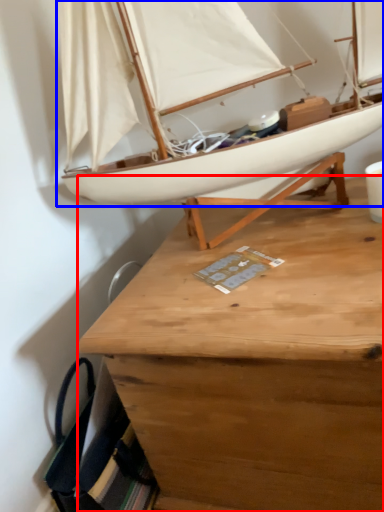
Question: Among these objects, which one is nearest to the camera, desk (highlighted by a red box) or boat (highlighted by a blue box)?

Choices:
 (A) desk
 (B) boat

Answer: (B)